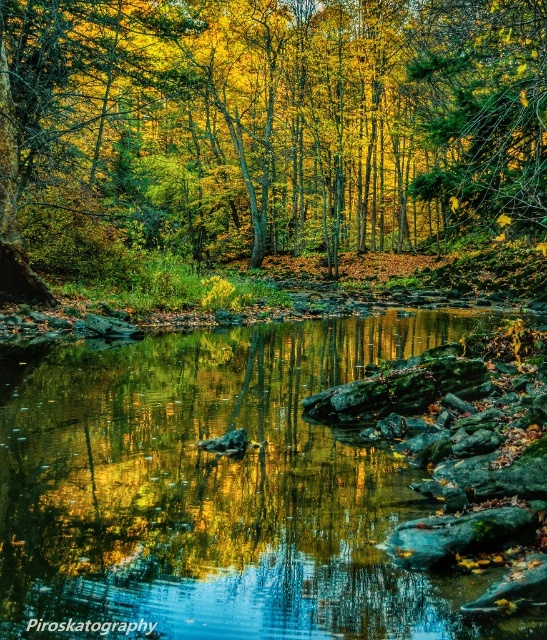
You are standing at the edge of the stream in the autumn scene. You notice two points marked in the image. Which point is closer to you, point (x=386, y=60) or point (x=51, y=424)?

Point (x=51, y=424) is closer to you because it is less further to the camera than point (x=386, y=60).

You are standing by the stream and want to take a photo of both the golden leafy tree at center and the green mossy rocks at center. Which object should you position to your left to include both in the frame?

The golden leafy tree at center is to the right of green mossy rocks at center. To include both in the frame, position the green mossy rocks at center to your left since it is on the left side relative to the golden leafy tree at center.